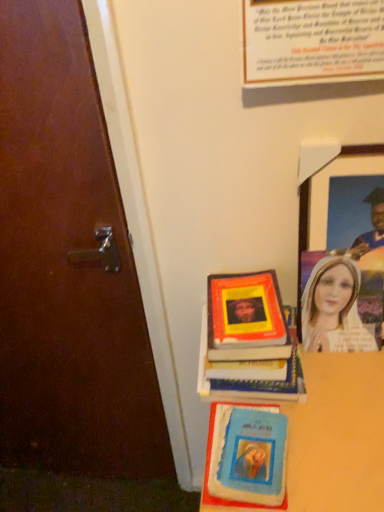
The height and width of the screenshot is (512, 384). What are the coordinates of `free space above smooth wooden table at lower right (from a real-world perspective)` in the screenshot? It's located at (321, 409).